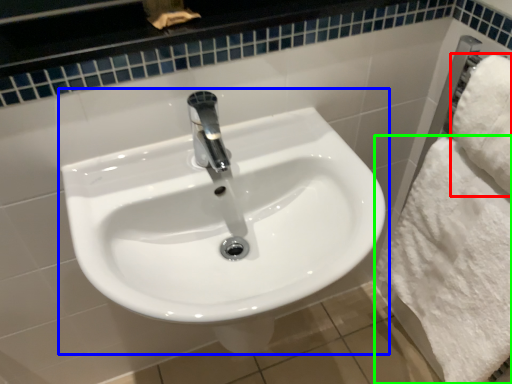
Question: Which is nearer to the bath towel (highlighted by a red box)? sink (highlighted by a blue box) or bath towel (highlighted by a green box).

Choices:
 (A) sink
 (B) bath towel

Answer: (B)